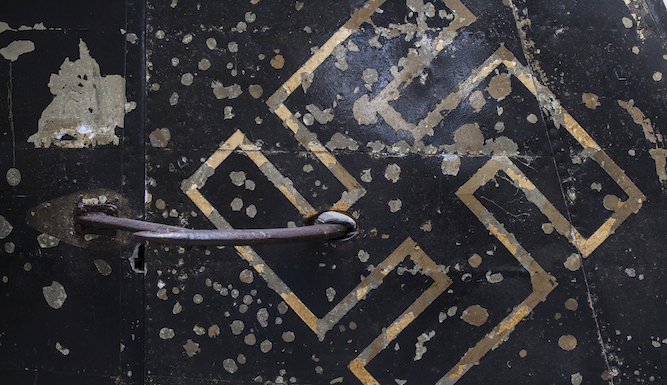
The height and width of the screenshot is (385, 667). I want to click on peeling paint, so click(81, 103), click(91, 92), click(17, 51), click(51, 294), click(243, 336), click(225, 89), click(197, 69).